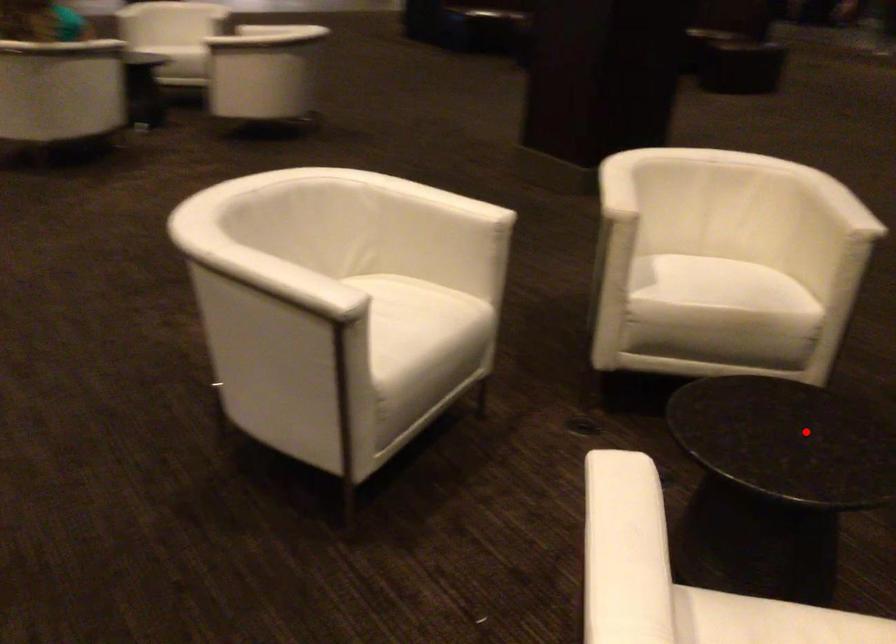
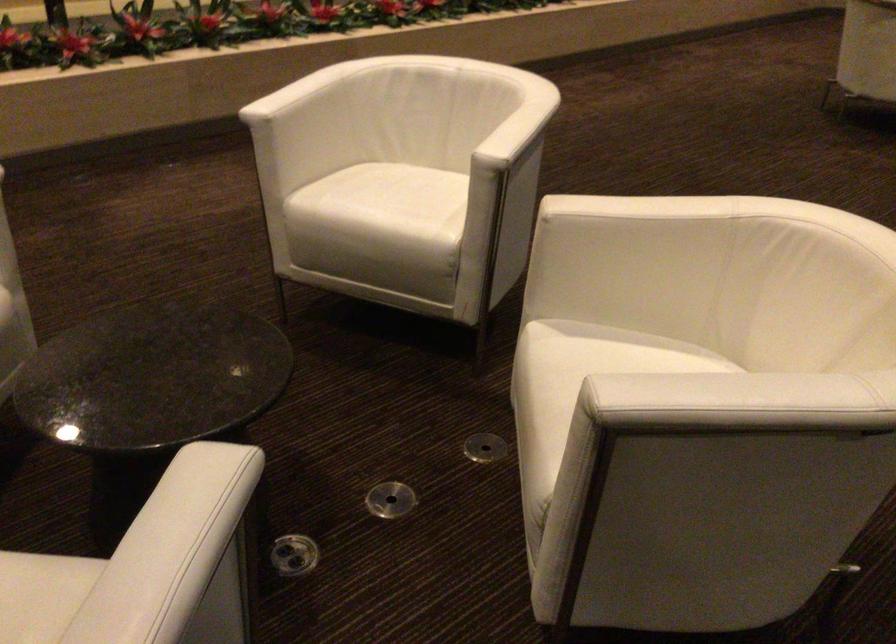
Find the pixel in the second image that matches the highlighted location in the first image.

(152, 377)